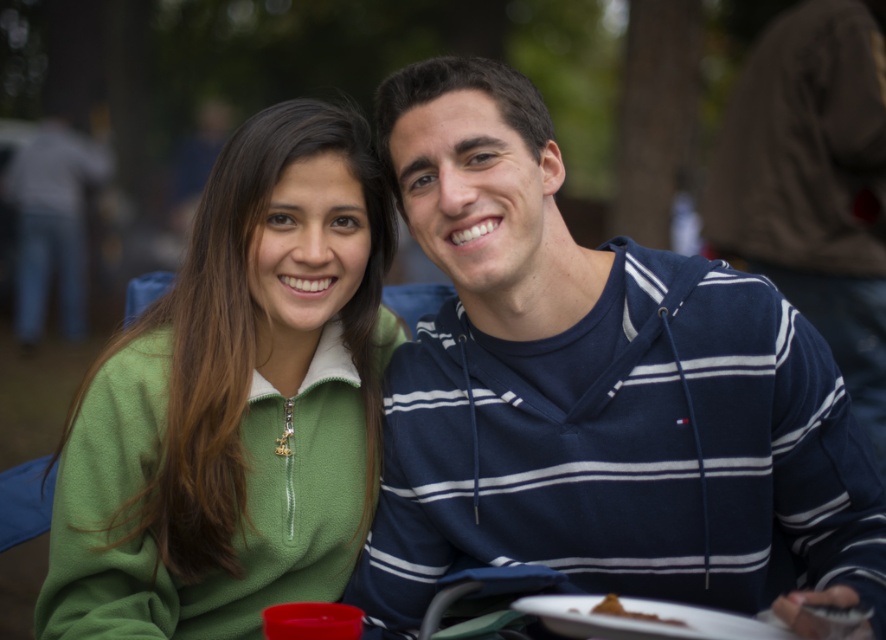
Question: Which of these objects is positioned closest to the navy blue hoodie at center?

Choices:
 (A) blue striped hoodie at center
 (B) white plastic plate at lower center
 (C) brown crumbly pastry at lower center
 (D) green fleece jacket at left

Answer: (B)

Question: Estimate the real-world distances between objects in this image. Which object is farther from the green fleece jacket at left?

Choices:
 (A) navy blue hoodie at center
 (B) brown crumbly pastry at lower center

Answer: (B)

Question: Does blue striped hoodie at center appear over brown crumbly pastry at lower center?

Choices:
 (A) no
 (B) yes

Answer: (B)

Question: Is green fleece jacket at left further to the viewer compared to white plastic plate at lower center?

Choices:
 (A) no
 (B) yes

Answer: (B)

Question: Is green fleece jacket at left thinner than brown crumbly pastry at lower center?

Choices:
 (A) yes
 (B) no

Answer: (B)

Question: Which point appears farthest from the camera in this image?

Choices:
 (A) (644, 616)
 (B) (533, 536)

Answer: (B)